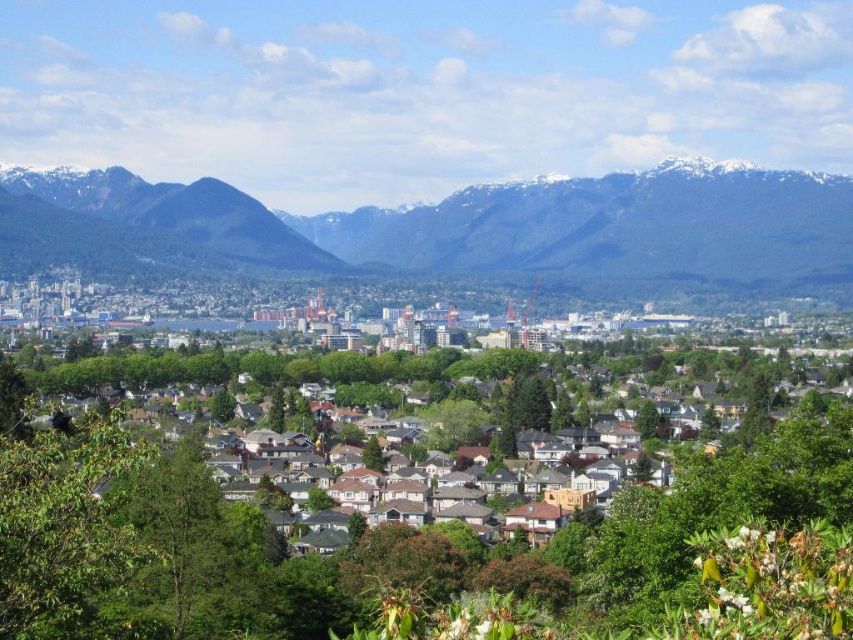
Question: Can you confirm if green textured mountains at center is bigger than white shingles at center?

Choices:
 (A) yes
 (B) no

Answer: (B)

Question: Can you confirm if green textured mountains at center is bigger than white shingles at center?

Choices:
 (A) yes
 (B) no

Answer: (B)

Question: Among these points, which one is farthest from the camera?

Choices:
 (A) (466, 230)
 (B) (788, 504)

Answer: (B)

Question: Does green textured mountains at center appear over white shingles at center?

Choices:
 (A) yes
 (B) no

Answer: (A)